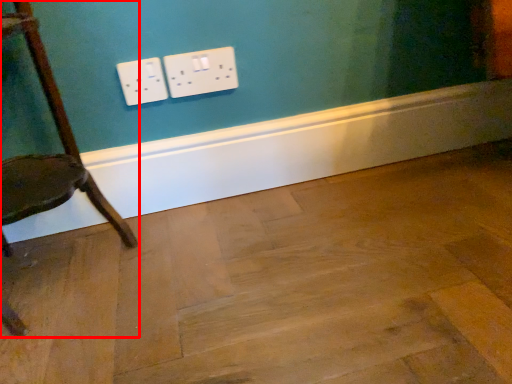
Question: From the image's perspective, considering the relative positions of chair (annotated by the red box) and plywood in the image provided, where is chair (annotated by the red box) located with respect to the staircase?

Choices:
 (A) above
 (B) below

Answer: (A)